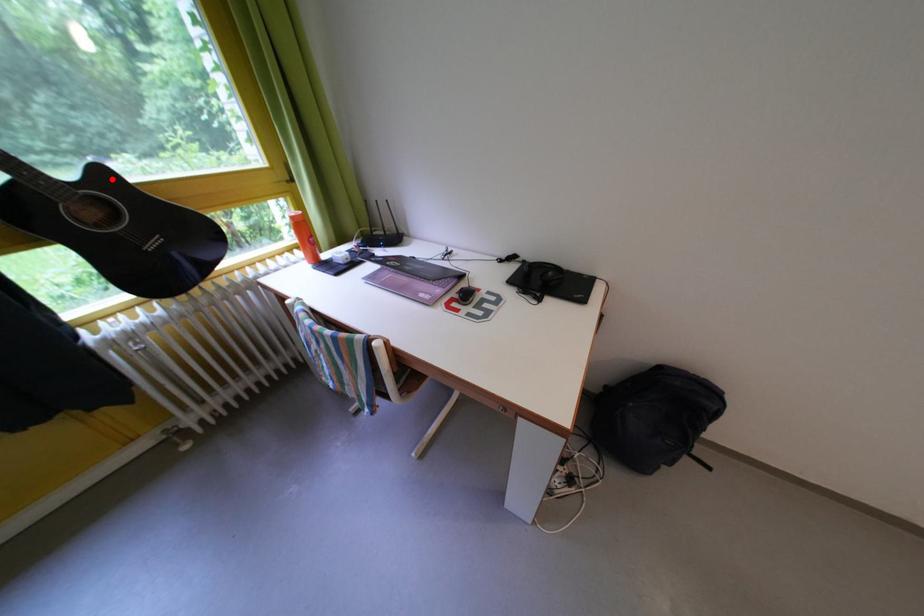
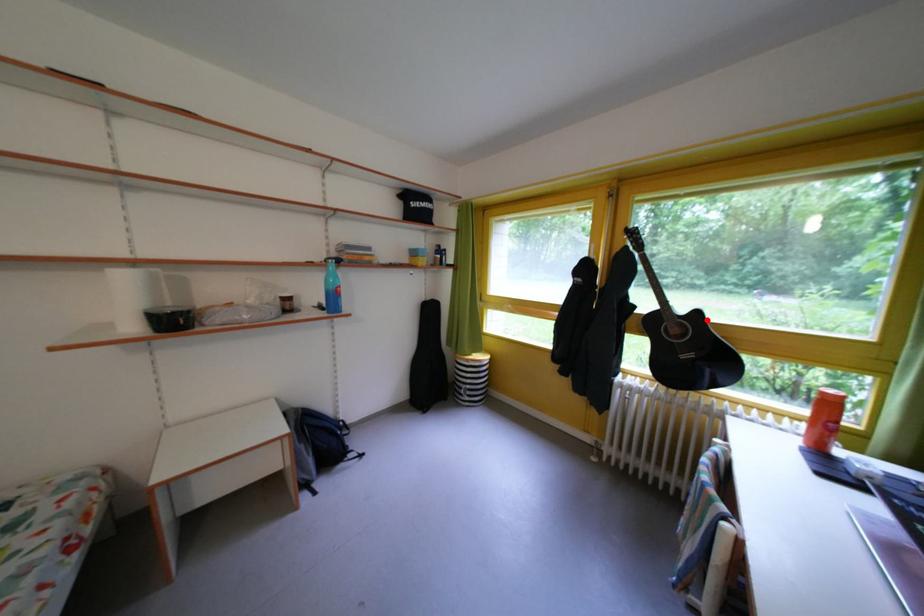
I am providing you with two images of the same scene from different viewpoints. A red point is marked on the first image and another point is marked on the second image. Do the highlighted points in image1 and image2 indicate the same real-world spot?

Yes